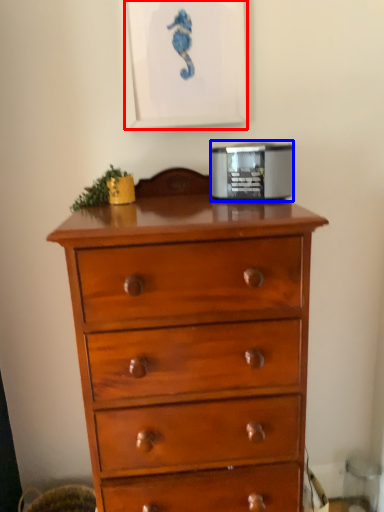
Question: Which object appears farthest to the camera in this image, picture frame (highlighted by a red box) or appliance (highlighted by a blue box)?

Choices:
 (A) picture frame
 (B) appliance

Answer: (A)